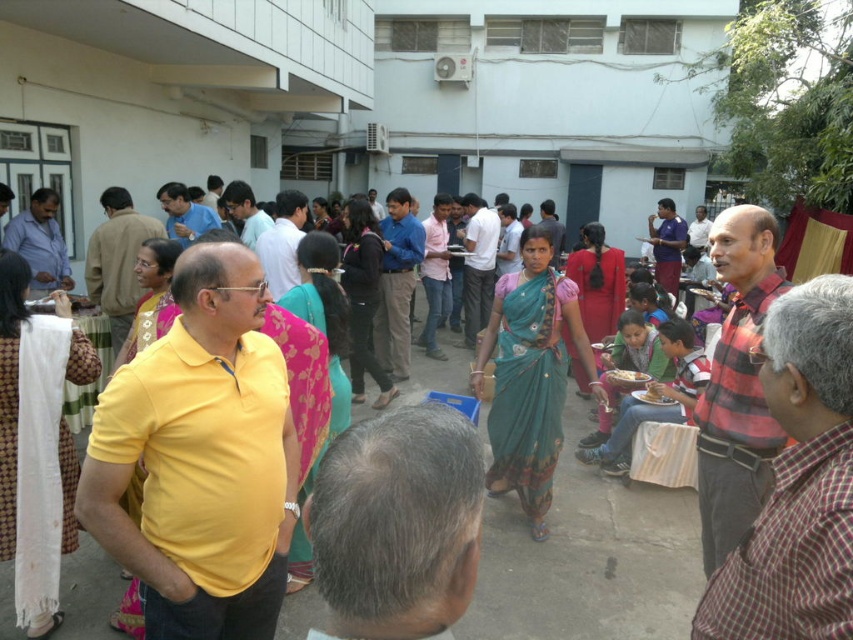
You are a photographer at this event and want to capture a photo that includes both the green sari at center and the white ceramic bowl at center. Since you want the sari to look wider in the photo than the bowl, will your current setup work?

The green sari at center is wider than the white ceramic bowl at center, so yes, the current setup will work to show the sari as wider than the bowl in the photo.

You are a photographer at the event and want to capture a photo of both the green sari at center and the white ceramic bowl at center without any obstruction. Given their sizes, which one should you position closer to the camera to ensure both are fully visible in the frame?

The green sari at center is much taller than the white ceramic bowl at center, so positioning the green sari at center closer to the camera will help ensure both are fully visible in the frame.

You are a guest at this event and want to place your drink on the nearest available surface. You are standing between the green sari at center and the white ceramic bowl at center. Which one is closer to you?

The green sari at center is 1.00 meters away from the white ceramic bowl at center. Since you are standing between them, you are equidistant from both, so either can be chosen as the nearest surface.